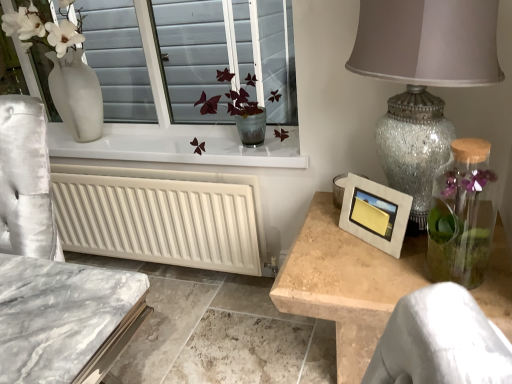
Question: Considering the relative positions of clear glass vase at right and translucent glass vase at center in the image provided, is clear glass vase at right in front of translucent glass vase at center?

Choices:
 (A) no
 (B) yes

Answer: (B)

Question: Could you tell me if clear glass vase at right is facing translucent glass vase at center?

Choices:
 (A) no
 (B) yes

Answer: (A)

Question: Is clear glass vase at right placed right next to translucent glass vase at center?

Choices:
 (A) no
 (B) yes

Answer: (A)

Question: Is clear glass vase at right not inside translucent glass vase at center?

Choices:
 (A) yes
 (B) no

Answer: (A)

Question: Does clear glass vase at right have a lesser height compared to translucent glass vase at center?

Choices:
 (A) no
 (B) yes

Answer: (A)

Question: Looking at their shapes, would you say translucent glass vase at center is wider or thinner than clear glass vase at right?

Choices:
 (A) thin
 (B) wide

Answer: (B)

Question: Is translucent glass vase at center situated inside clear glass vase at right or outside?

Choices:
 (A) outside
 (B) inside

Answer: (A)

Question: Visually, is translucent glass vase at center positioned to the left or to the right of clear glass vase at right?

Choices:
 (A) right
 (B) left

Answer: (B)

Question: From the image's perspective, is translucent glass vase at center located above or below clear glass vase at right?

Choices:
 (A) below
 (B) above

Answer: (B)

Question: From the image's perspective, is crackle glass lampshade at right positioned above or below matte silver picture frame at right?

Choices:
 (A) above
 (B) below

Answer: (A)

Question: Is crackle glass lampshade at right spatially inside matte silver picture frame at right, or outside of it?

Choices:
 (A) inside
 (B) outside

Answer: (B)

Question: Based on their positions, is crackle glass lampshade at right located to the left or right of matte silver picture frame at right?

Choices:
 (A) left
 (B) right

Answer: (B)

Question: From a real-world perspective, is crackle glass lampshade at right positioned above or below matte silver picture frame at right?

Choices:
 (A) below
 (B) above

Answer: (B)

Question: In terms of size, does translucent glass vase at center appear bigger or smaller than crackle glass lampshade at right?

Choices:
 (A) small
 (B) big

Answer: (A)

Question: Would you say translucent glass vase at center is to the left or to the right of crackle glass lampshade at right in the picture?

Choices:
 (A) right
 (B) left

Answer: (B)